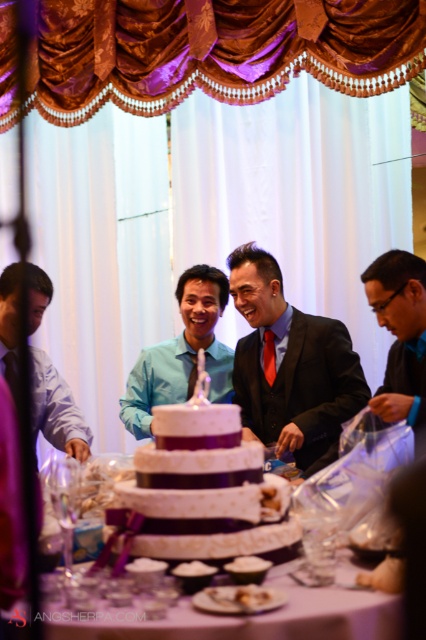
Between point (351, 552) and point (178, 292), which one is positioned in front?

Point (351, 552) is more forward.

Does white textured cake at center have a lesser width compared to blue satin shirt at center?

Incorrect, white textured cake at center's width is not less than blue satin shirt at center's.

Identify the location of white textured cake at center. This screenshot has height=640, width=426. (253, 616).

Is black satin suit at center thinner than matte black suit at lower right?

In fact, black satin suit at center might be wider than matte black suit at lower right.

Is black satin suit at center wider than matte black suit at lower right?

Yes, black satin suit at center is wider than matte black suit at lower right.

Who is more forward, [264,289] or [400,340]?

Point [400,340] is in front.

You are a GUI agent. You are given a task and a screenshot of the screen. Output one action in this format:
    pyautogui.click(x=<x>, y=<y>)
    Task: Click on the black satin suit at center
    The width and height of the screenshot is (426, 640).
    Given the screenshot: What is the action you would take?
    pyautogui.click(x=290, y=364)

Does black satin suit at center have a lesser width compared to matte blue shirt at left?

In fact, black satin suit at center might be wider than matte blue shirt at left.

Is point (333, 323) farther from viewer compared to point (29, 269)?

Yes, it is behind point (29, 269).

Identify the location of black satin suit at center. (290, 364).